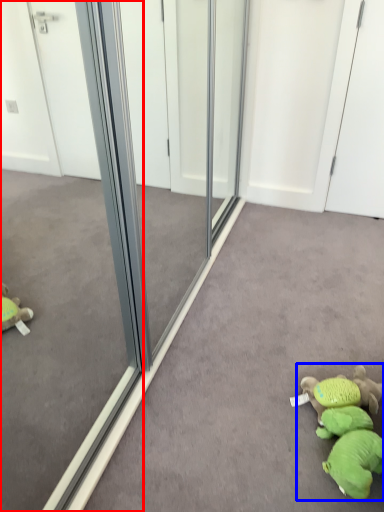
Question: Among these objects, which one is nearest to the camera, glass door (highlighted by a red box) or toy (highlighted by a blue box)?

Choices:
 (A) glass door
 (B) toy

Answer: (A)